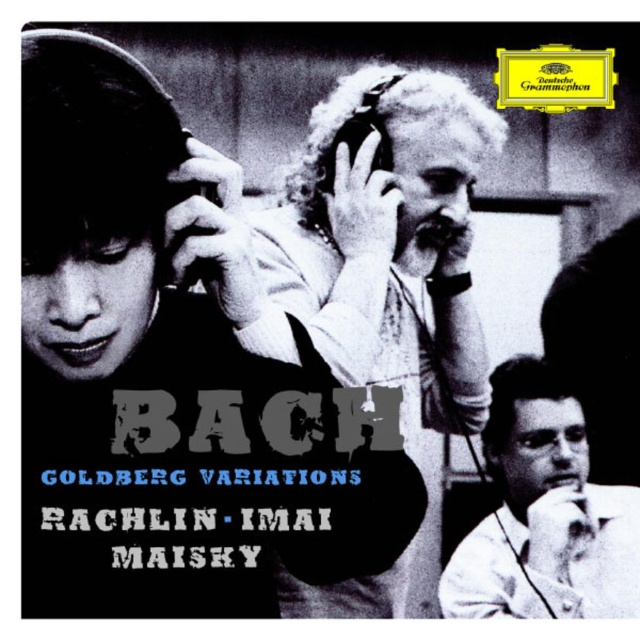
Question: Which object is closer to the camera taking this photo?

Choices:
 (A) white curly hair at upper center
 (B) white smooth shirt at lower right

Answer: (A)

Question: Which point is farther to the camera?

Choices:
 (A) (410, 404)
 (B) (518, 541)

Answer: (B)

Question: Does white curly hair at upper center have a larger size compared to white smooth shirt at lower right?

Choices:
 (A) no
 (B) yes

Answer: (B)

Question: Is white curly hair at upper center to the left of white smooth shirt at lower right from the viewer's perspective?

Choices:
 (A) no
 (B) yes

Answer: (B)

Question: Which point is closer to the camera?

Choices:
 (A) white curly hair at upper center
 (B) white smooth shirt at lower right

Answer: (A)

Question: Is white curly hair at upper center above white smooth shirt at lower right?

Choices:
 (A) yes
 (B) no

Answer: (A)